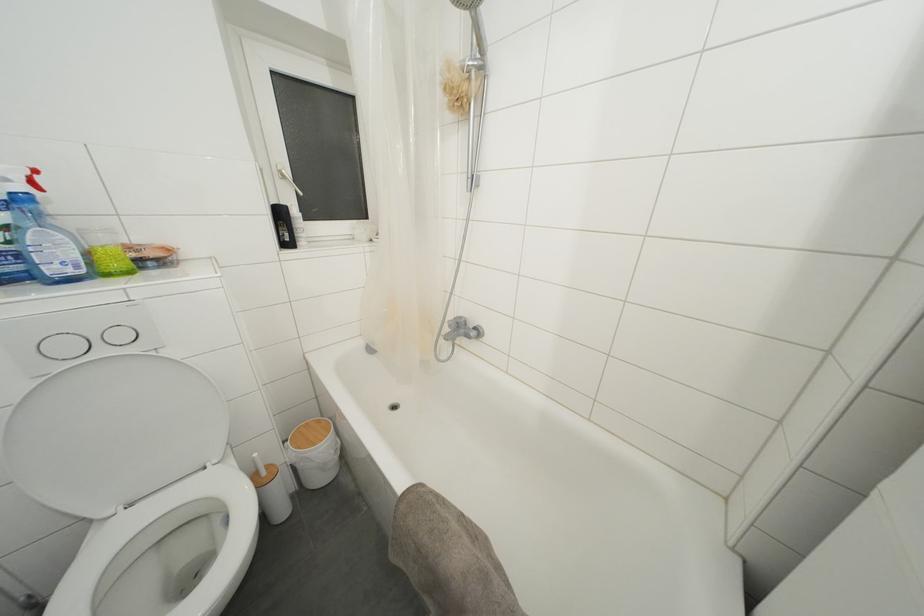
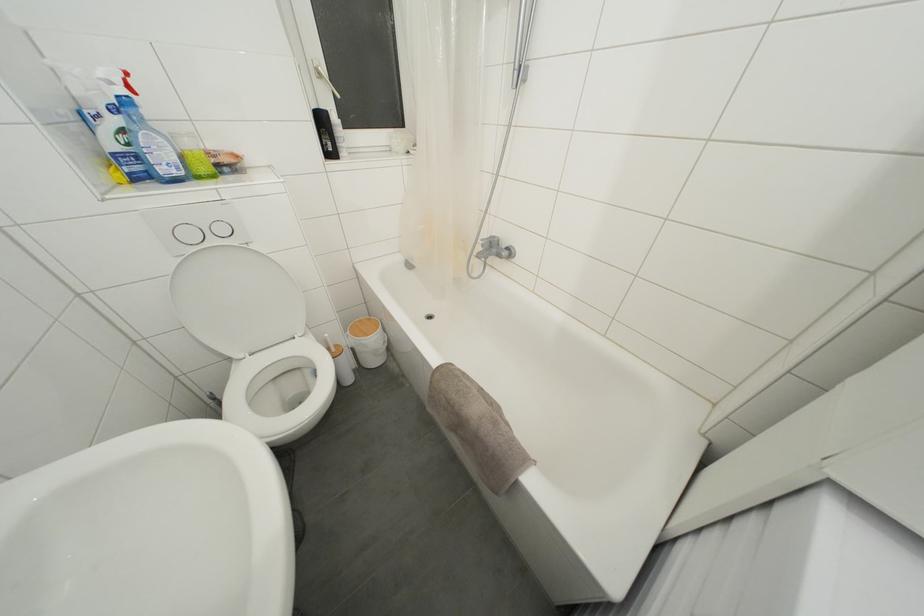
Where in the second image is the point corresponding to [108,245] from the first image?

(193, 148)